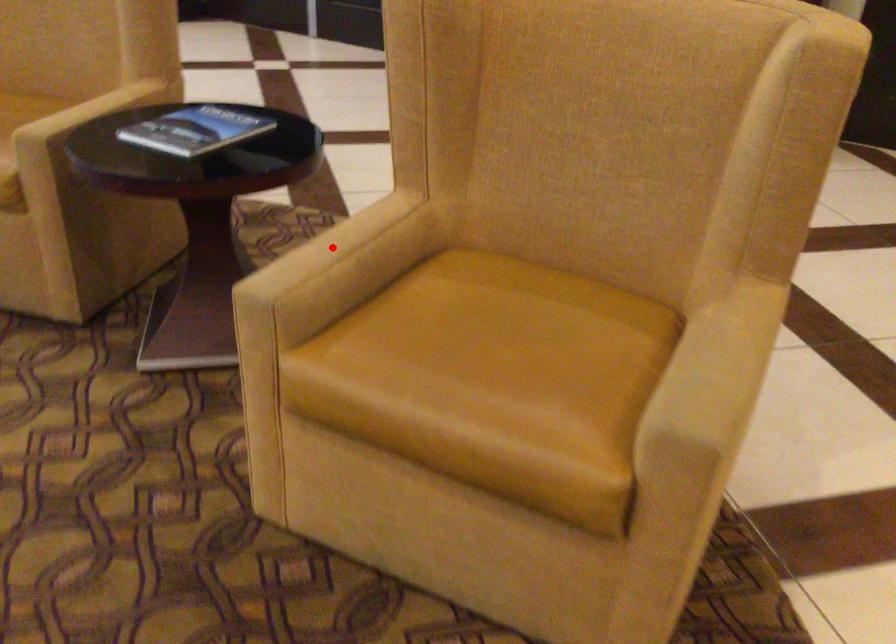
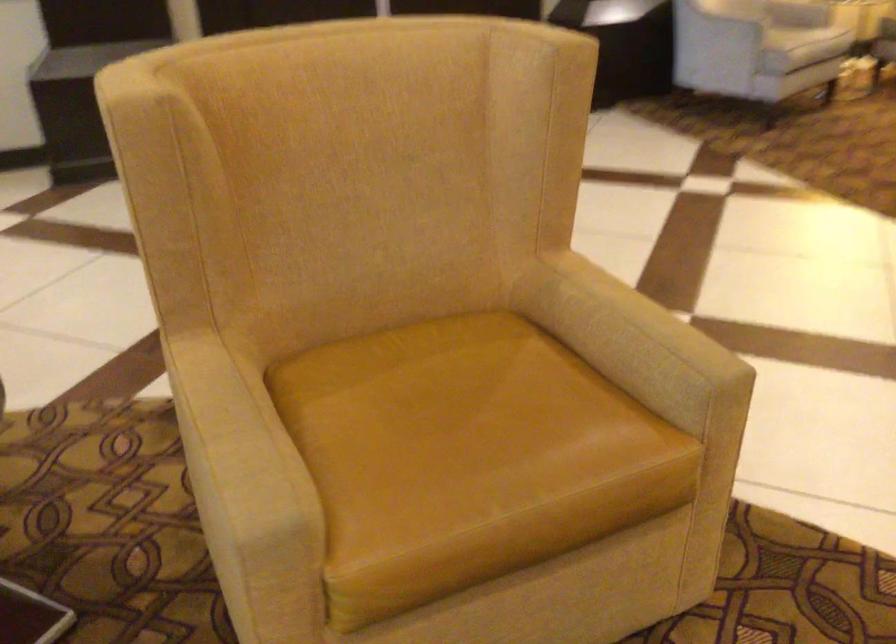
Find the pixel in the second image that matches the highlighted location in the first image.

(235, 435)